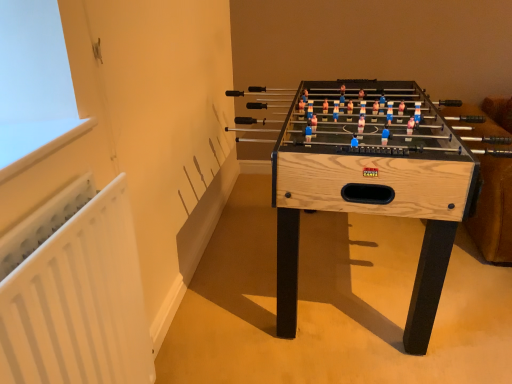
Find the location of a particular element. Image resolution: width=512 pixels, height=384 pixels. natural wood foosball table at center is located at coordinates (372, 183).

This screenshot has height=384, width=512. Describe the element at coordinates (372, 183) in the screenshot. I see `natural wood foosball table at center` at that location.

Measure the distance between natural wood foosball table at center and camera.

The depth of natural wood foosball table at center is 4.13 feet.

At what (x,y) coordinates should I click in order to perform the action: click on natural wood foosball table at center. Please return your answer as a coordinate pair (x, y). Image resolution: width=512 pixels, height=384 pixels. Looking at the image, I should click on (372, 183).